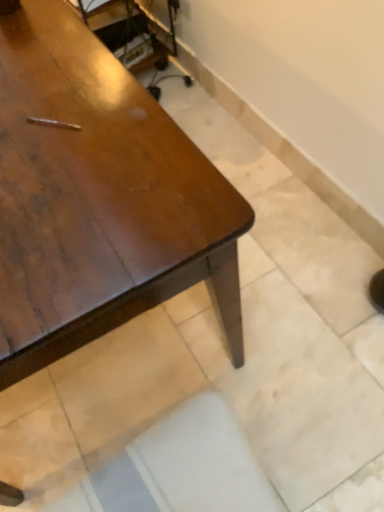
What is the approximate width of matte wood desk at upper left?

It is 5.11 feet.

This screenshot has height=512, width=384. What do you see at coordinates (98, 198) in the screenshot?
I see `matte wood desk at upper left` at bounding box center [98, 198].

Locate an element on the screen. This screenshot has height=512, width=384. matte wood desk at upper left is located at coordinates (98, 198).

I want to click on matte wood desk at upper left, so click(x=98, y=198).